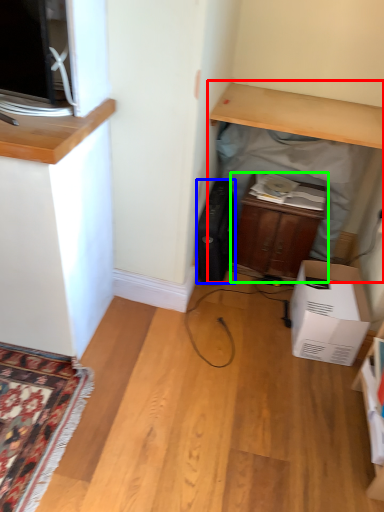
Question: Which object is positioned closest to computer desk (highlighted by a red box)? Select from appliance (highlighted by a blue box) and cabinetry (highlighted by a green box).

Choices:
 (A) appliance
 (B) cabinetry

Answer: (B)